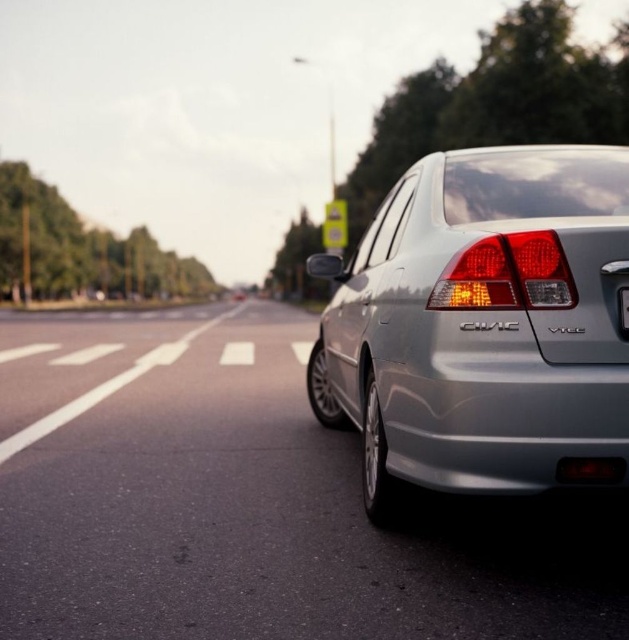
Question: Among these objects, which one is nearest to the camera?

Choices:
 (A) black plastic license plate at rear
 (B) matte plastic brake light at rear
 (C) satin silver sedan at center

Answer: (C)

Question: Is satin silver sedan at center behind matte plastic brake light at rear?

Choices:
 (A) yes
 (B) no

Answer: (B)

Question: Can you confirm if satin silver sedan at center is positioned to the right of matte plastic brake light at rear?

Choices:
 (A) no
 (B) yes

Answer: (A)

Question: Which object appears closest to the camera in this image?

Choices:
 (A) satin silver sedan at center
 (B) matte plastic brake light at rear
 (C) black plastic license plate at rear

Answer: (A)

Question: Is satin silver sedan at center further to camera compared to matte plastic brake light at rear?

Choices:
 (A) no
 (B) yes

Answer: (A)

Question: Estimate the real-world distances between objects in this image. Which object is closer to the matte plastic brake light at rear?

Choices:
 (A) satin silver sedan at center
 (B) black plastic license plate at rear

Answer: (B)